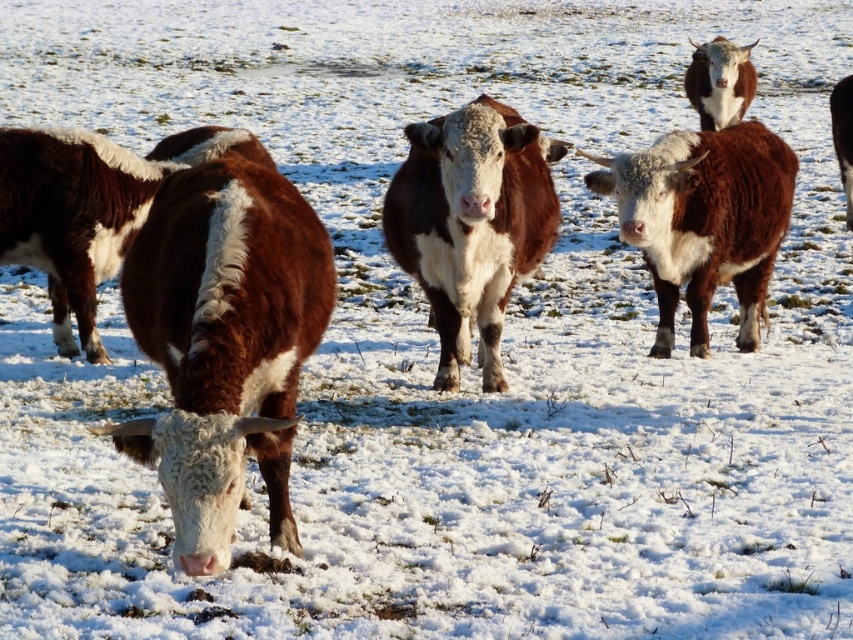
You are standing in the snowy field and want to approach the brown furry cow at center and the brown fuzzy cow at left. Which cow should you walk towards first if you want to reach the one closer to the left side of the field?

The brown fuzzy cow at left is closer to the left side of the field because it is positioned to the left of the brown furry cow at center.

You are standing in the snowy field and want to approach the brown furry cow at center. If your walking speed is 1.5 meters per second, how long will it take you to reach the cow?

The brown furry cow at center is 7.26 meters away from the viewer. At a walking speed of 1.5 meters per second, it would take approximately 4.84 seconds to reach the cow.